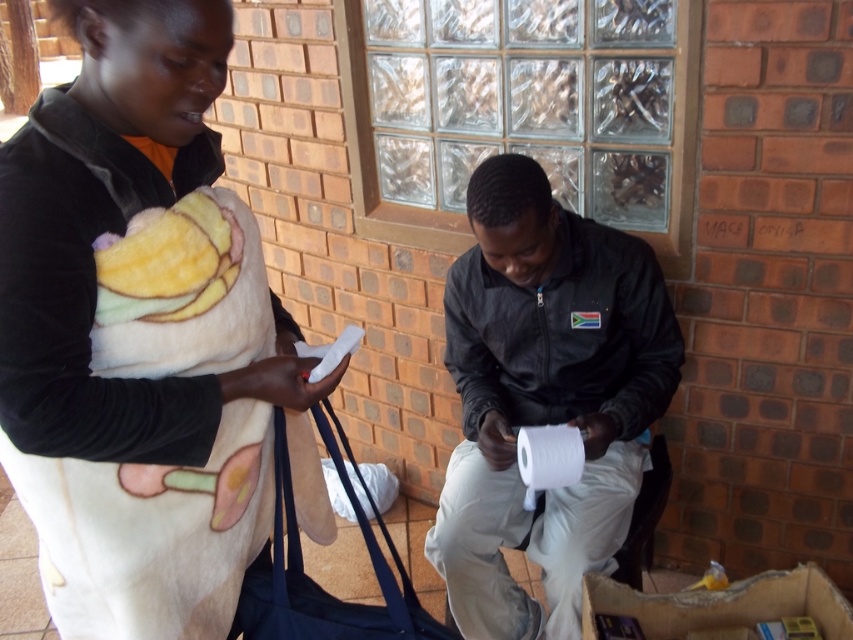
You are standing in a bathroom and see a white matte toilet paper at center. There is a point marked at coordinate (544,396). Is this point located on the toilet paper?

Yes, the point at coordinate (544,396) is located on the white matte toilet paper at center.

You are organizing a small gift basket and have the white matte toilet paper at center and the white soft blanket at upper left. Which item would you choose if you need to provide something larger in size for the gift?

The white matte toilet paper at center has a larger size compared to the white soft blanket at upper left, so you should choose the white matte toilet paper at center for the gift basket.

You are a photographer standing in the room and want to take a photo of both the white matte toilet paper at center and the white soft blanket at upper left. Which object should you focus on first to ensure both are in focus?

You should focus on the white matte toilet paper at center first because it is closer to you than the white soft blanket at upper left. By focusing on the closer object, the depth of field may include the farther object as well.